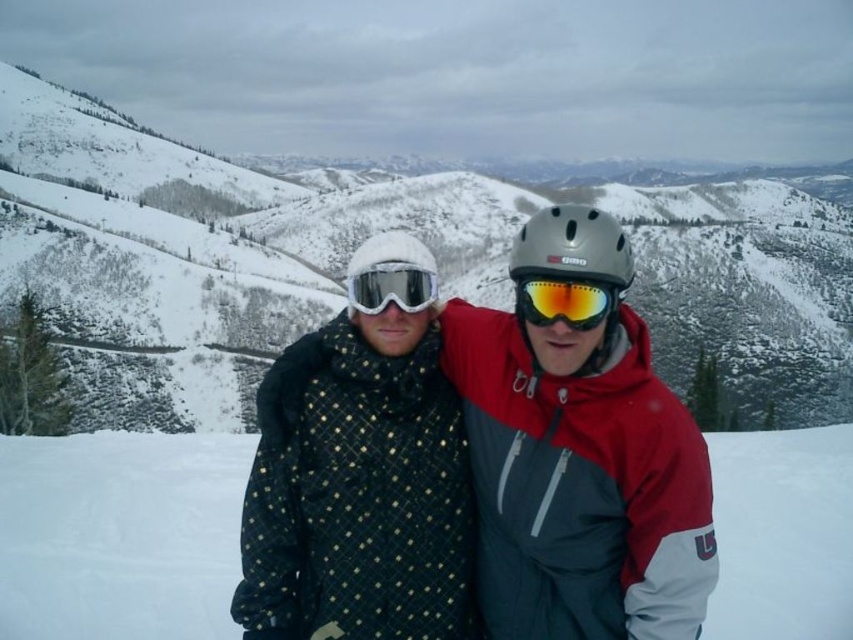
Question: Is white fleece hat at center behind matte black goggles at center?

Choices:
 (A) no
 (B) yes

Answer: (B)

Question: Which of the following is the closest to the observer?

Choices:
 (A) quilted fabric jacket at center
 (B) white fleece hat at center

Answer: (A)

Question: Based on their relative distances, which object is nearer to the quilted fabric jacket at center?

Choices:
 (A) matte black goggles at center
 (B) shiny orange ski goggles at center
 (C) snowy mountain at center

Answer: (B)

Question: Is quilted fabric jacket at center above white fleece hat at center?

Choices:
 (A) no
 (B) yes

Answer: (A)

Question: Does snowy mountain at center have a smaller size compared to matte black goggles at center?

Choices:
 (A) no
 (B) yes

Answer: (A)

Question: Which point appears farthest from the camera in this image?

Choices:
 (A) (595, 282)
 (B) (392, 264)
 (C) (523, 294)
 (D) (408, 243)

Answer: (D)